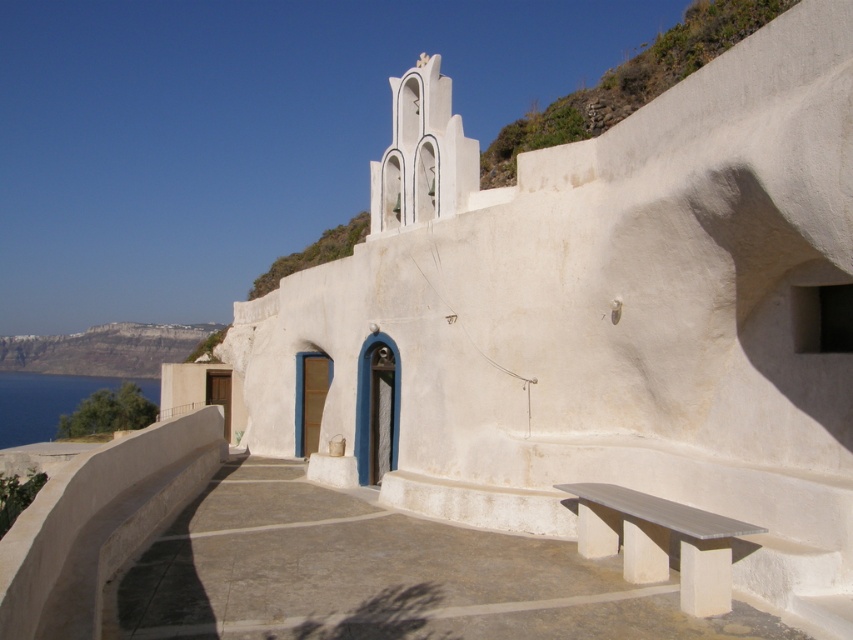
Question: Which object appears farthest from the camera in this image?

Choices:
 (A) blue water at lower left
 (B) greenish-brown rocky hillside at upper right
 (C) smooth white bench at lower right

Answer: (A)

Question: Can you confirm if smooth white bench at lower right is bigger than white rocky cliff at left?

Choices:
 (A) yes
 (B) no

Answer: (B)

Question: Which point is farther to the camera?

Choices:
 (A) greenish-brown rocky hillside at upper right
 (B) white rocky cliff at left
 (C) blue water at lower left

Answer: (B)

Question: Can you confirm if white rocky cliff at left is positioned to the right of blue water at lower left?

Choices:
 (A) no
 (B) yes

Answer: (B)

Question: Estimate the real-world distances between objects in this image. Which object is farther from the white rocky cliff at left?

Choices:
 (A) greenish-brown rocky hillside at upper right
 (B) smooth white bench at lower right
 (C) blue water at lower left

Answer: (B)

Question: Where is greenish-brown rocky hillside at upper right located in relation to blue water at lower left in the image?

Choices:
 (A) left
 (B) right

Answer: (B)